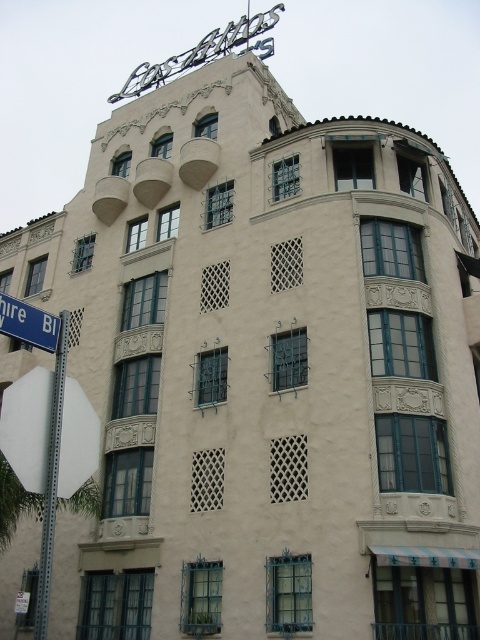
Does point (38, 624) come farther from viewer compared to point (44, 316)?

That is False.

The width and height of the screenshot is (480, 640). Describe the element at coordinates (51, 481) in the screenshot. I see `metallic pole at left` at that location.

What are the coordinates of `metallic pole at left` in the screenshot? It's located at (51, 481).